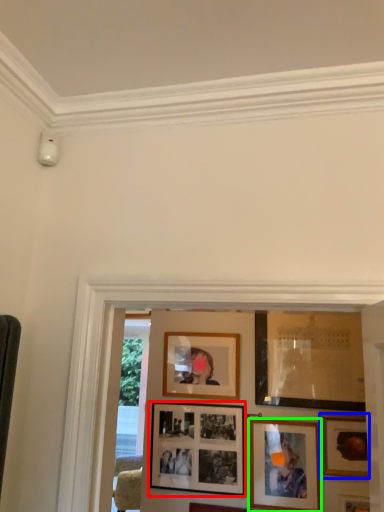
Question: Based on their relative distances, which object is farther from picture frame (highlighted by a red box)? Choose from picture frame (highlighted by a blue box) and picture frame (highlighted by a green box).

Choices:
 (A) picture frame
 (B) picture frame

Answer: (A)